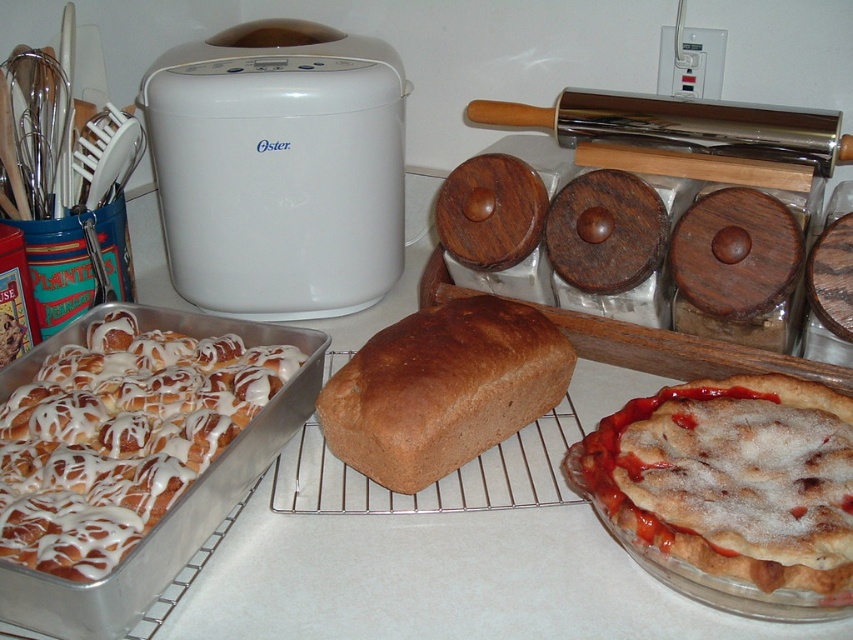
Between white glazed pastry at left and glazed pastry at center, which one appears on the right side from the viewer's perspective?

glazed pastry at center

Is white glazed pastry at left to the left of glazed pastry at center from the viewer's perspective?

Indeed, white glazed pastry at left is positioned on the left side of glazed pastry at center.

Does point (119, 349) come closer to viewer compared to point (738, 436)?

No, (119, 349) is behind (738, 436).

The width and height of the screenshot is (853, 640). Find the location of `white glazed pastry at left`. white glazed pastry at left is located at coordinates (120, 436).

Locate an element on the screen. white plastic bread maker at upper left is located at coordinates (277, 168).

The height and width of the screenshot is (640, 853). I want to click on white plastic bread maker at upper left, so click(x=277, y=168).

Who is taller, white plastic bread maker at upper left or white glazed pastry at left?

white plastic bread maker at upper left is taller.

Looking at this image, is white plastic bread maker at upper left wider than white glazed pastry at left?

Yes.

This screenshot has height=640, width=853. I want to click on white plastic bread maker at upper left, so click(x=277, y=168).